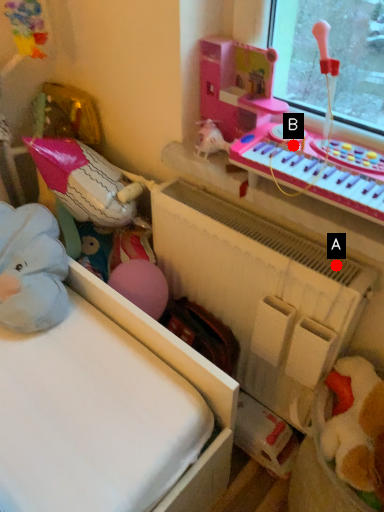
Question: Two points are circled on the image, labeled by A and B beside each circle. Among these points, which one is farthest from the camera?

Choices:
 (A) A is further
 (B) B is further

Answer: (A)